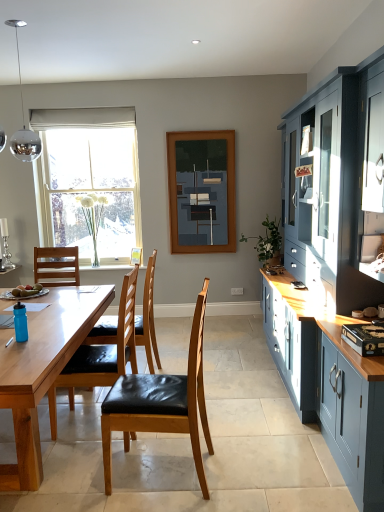
Find the location of a particular element. This screenshot has width=384, height=512. vacant area that is situated to the right of brown leather chair at center, which is the third chair from back to front is located at coordinates (240, 467).